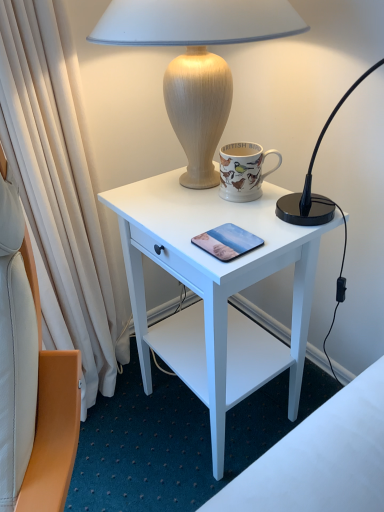
Question: Can you confirm if white matte desk at center is positioned to the left of matte glass pad at center?

Choices:
 (A) yes
 (B) no

Answer: (A)

Question: Does white matte desk at center turn towards matte glass pad at center?

Choices:
 (A) no
 (B) yes

Answer: (A)

Question: From a real-world perspective, is white matte desk at center positioned over matte glass pad at center based on gravity?

Choices:
 (A) no
 (B) yes

Answer: (A)

Question: Is white matte desk at center positioned beyond the bounds of matte glass pad at center?

Choices:
 (A) yes
 (B) no

Answer: (A)

Question: Would you say white matte desk at center contains matte glass pad at center?

Choices:
 (A) yes
 (B) no

Answer: (A)

Question: Can you confirm if white matte desk at center is positioned to the right of matte glass pad at center?

Choices:
 (A) yes
 (B) no

Answer: (B)

Question: Is wooden lamp at upper center looking in the opposite direction of matte glass pad at center?

Choices:
 (A) no
 (B) yes

Answer: (A)

Question: From the image's perspective, would you say wooden lamp at upper center is positioned over matte glass pad at center?

Choices:
 (A) yes
 (B) no

Answer: (A)

Question: Is the depth of wooden lamp at upper center less than that of matte glass pad at center?

Choices:
 (A) yes
 (B) no

Answer: (A)

Question: From a real-world perspective, is wooden lamp at upper center physically above matte glass pad at center?

Choices:
 (A) yes
 (B) no

Answer: (A)

Question: Is wooden lamp at upper center at the left side of matte glass pad at center?

Choices:
 (A) no
 (B) yes

Answer: (B)

Question: Is wooden lamp at upper center wider than matte glass pad at center?

Choices:
 (A) no
 (B) yes

Answer: (B)

Question: Is porcelain mug with colorful birds at upper center outside white matte desk at center?

Choices:
 (A) yes
 (B) no

Answer: (A)